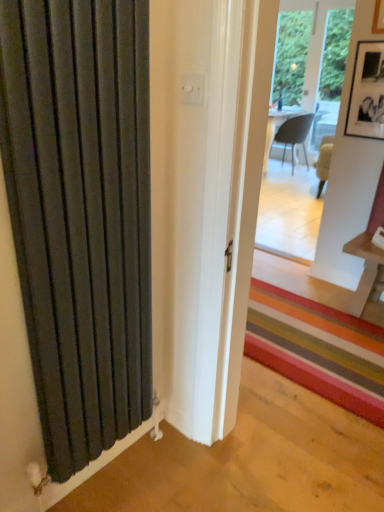
Question: Based on their sizes in the image, would you say matte black radiator at left is bigger or smaller than black matte picture frame at upper right?

Choices:
 (A) small
 (B) big

Answer: (B)

Question: Does point (132, 385) appear closer or farther from the camera than point (379, 97)?

Choices:
 (A) closer
 (B) farther

Answer: (A)

Question: Which object is positioned farthest from the matte gray chair at center?

Choices:
 (A) matte black radiator at left
 (B) black matte picture frame at upper right

Answer: (A)

Question: Based on their relative distances, which object is nearer to the matte gray chair at center?

Choices:
 (A) matte black radiator at left
 (B) black matte picture frame at upper right

Answer: (B)